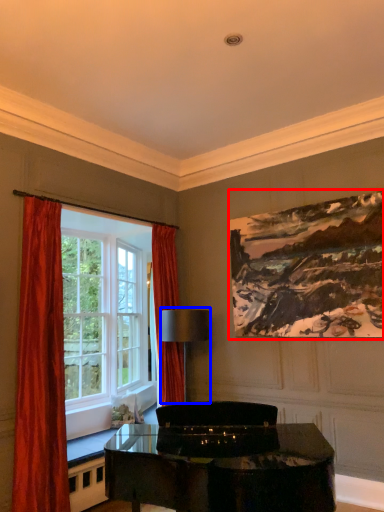
Question: Which object is closer to the camera taking this photo, picture frame (highlighted by a red box) or lamp (highlighted by a blue box)?

Choices:
 (A) picture frame
 (B) lamp

Answer: (A)